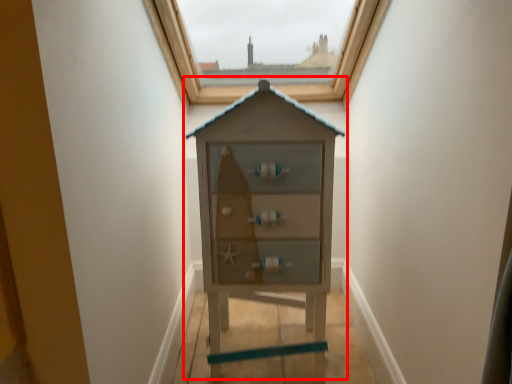
Question: Where is dresser (annotated by the red box) located in relation to window in the image?

Choices:
 (A) right
 (B) left

Answer: (A)